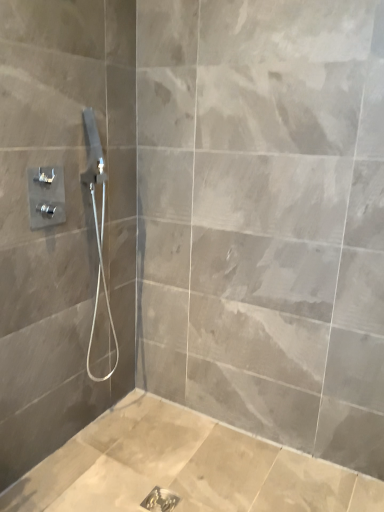
This screenshot has width=384, height=512. In order to click on satin nickel showerhead at upper left in this screenshot , I will do `click(97, 221)`.

Measure the distance between satin nickel showerhead at upper left and camera.

A distance of 1.50 meters exists between satin nickel showerhead at upper left and camera.

Describe the element at coordinates (97, 221) in the screenshot. This screenshot has width=384, height=512. I see `satin nickel showerhead at upper left` at that location.

I want to click on satin nickel showerhead at upper left, so click(97, 221).